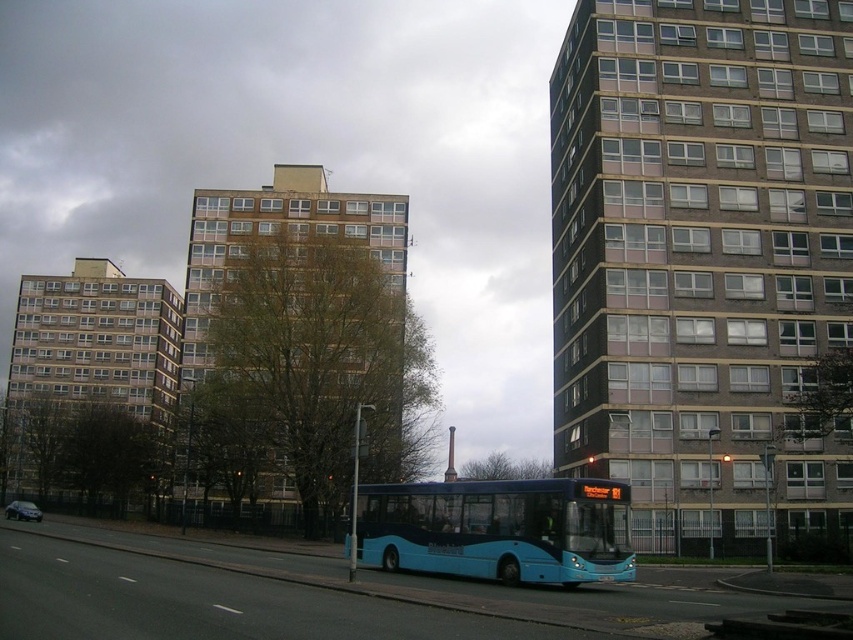
Is blue matte bus at center wider than metallic silver car at lower left?

In fact, blue matte bus at center might be narrower than metallic silver car at lower left.

Can you confirm if blue matte bus at center is positioned below metallic silver car at lower left?

No.

What do you see at coordinates (498, 529) in the screenshot?
I see `blue matte bus at center` at bounding box center [498, 529].

Image resolution: width=853 pixels, height=640 pixels. I want to click on blue matte bus at center, so click(498, 529).